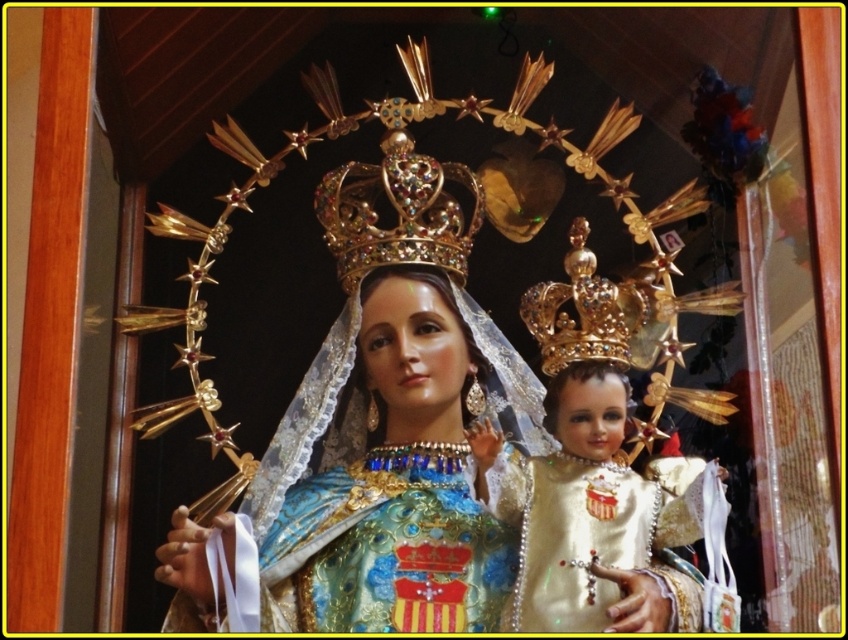
Question: Where is gold glossy crown at center located in relation to gold shiny crown at upper center in the image?

Choices:
 (A) left
 (B) right

Answer: (A)

Question: Among these objects, which one is nearest to the camera?

Choices:
 (A) gold jeweled crown at center
 (B) gold shiny crown at upper center

Answer: (B)

Question: Is gold glossy crown at center thinner than gold jeweled crown at center?

Choices:
 (A) yes
 (B) no

Answer: (B)

Question: Which object appears farthest from the camera in this image?

Choices:
 (A) gold jeweled crown at center
 (B) gold shiny crown at upper center

Answer: (A)

Question: Can you confirm if gold glossy crown at center is bigger than gold shiny crown at upper center?

Choices:
 (A) no
 (B) yes

Answer: (B)

Question: Which object is farther from the camera taking this photo?

Choices:
 (A) gold jeweled crown at center
 (B) gold shiny crown at upper center
 (C) gold glossy crown at center

Answer: (A)